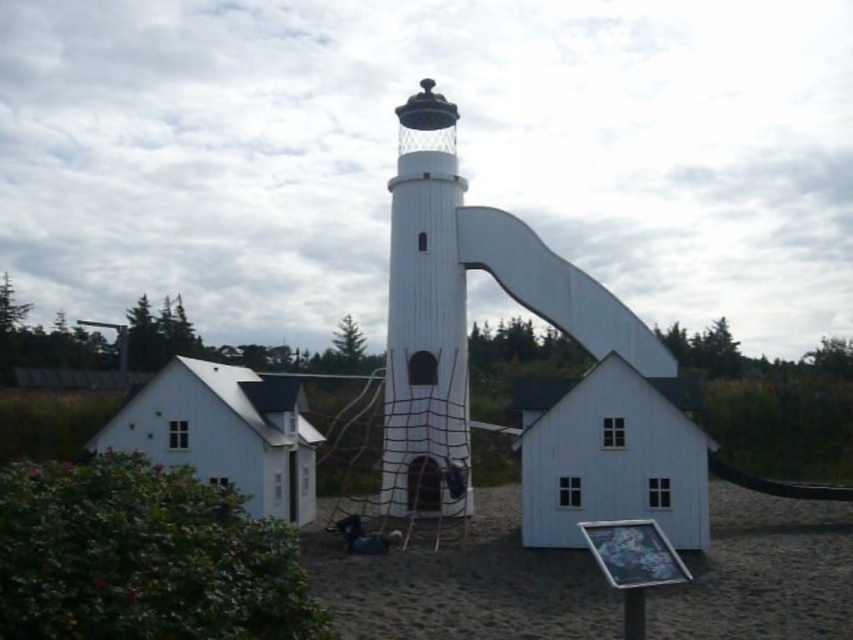
You are a child visiting this miniature village and want to see the top of the white wood tower at center. Can you climb the brown sandy ground at center to reach the top?

The brown sandy ground at center is shorter than the white wood tower at center, so climbing the brown sandy ground at center won not help you reach the top of the white wood tower at center.

You are a child visiting this miniature village and want to build a sandcastle. Given the presence of the brown sandy ground at center and the white wood tower at center, which location would be more suitable for building your sandcastle?

The brown sandy ground at center is larger in size than the white wood tower at center, so it would be more suitable for building a sandcastle as there is more space available.

You are standing at the lighthouse and want to place a decorative flag at a point that is closer to you than another point. Which point should you choose between point (575,560) and point (410,492)?

Point (575,560) is in front of point (410,492), so you should choose point (575,560) as it is closer to you.